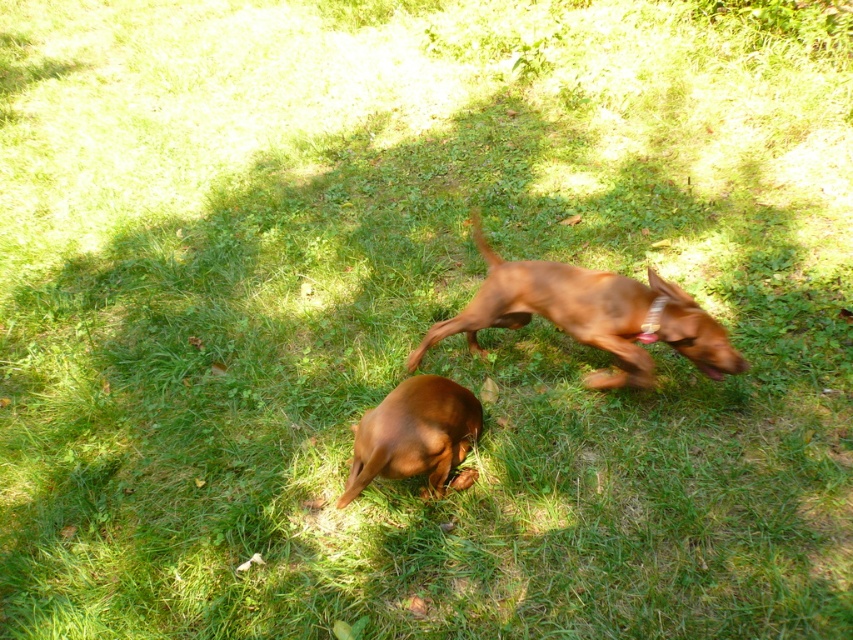
Does brown glossy dog at upper center have a larger size compared to shiny brown dog at center?

Yes, brown glossy dog at upper center is bigger than shiny brown dog at center.

Is point (473, 310) farther from viewer compared to point (469, 420)?

That is True.

Is point (500, 260) farther from camera compared to point (468, 392)?

That is True.

This screenshot has height=640, width=853. What are the coordinates of `brown glossy dog at upper center` in the screenshot? It's located at (x=590, y=316).